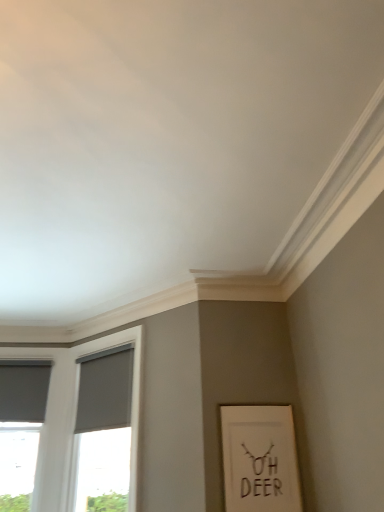
Question: Does white matte picture frame at lower right have a smaller size compared to matte gray window at left?

Choices:
 (A) yes
 (B) no

Answer: (A)

Question: Is white matte picture frame at lower right located outside matte gray window at left?

Choices:
 (A) no
 (B) yes

Answer: (B)

Question: Can you confirm if white matte picture frame at lower right is positioned to the left of matte gray window at left?

Choices:
 (A) no
 (B) yes

Answer: (A)

Question: Does white matte picture frame at lower right come behind matte gray window at left?

Choices:
 (A) no
 (B) yes

Answer: (A)

Question: Is white matte picture frame at lower right facing away from matte gray window at left?

Choices:
 (A) yes
 (B) no

Answer: (B)

Question: Is white matte picture frame at lower right surrounding matte gray window at left?

Choices:
 (A) yes
 (B) no

Answer: (B)

Question: Is matte gray window at left turned away from white matte picture frame at lower right?

Choices:
 (A) no
 (B) yes

Answer: (A)

Question: Is matte gray window at left to the left of white matte picture frame at lower right from the viewer's perspective?

Choices:
 (A) yes
 (B) no

Answer: (A)

Question: Does matte gray window at left have a smaller size compared to white matte picture frame at lower right?

Choices:
 (A) no
 (B) yes

Answer: (A)

Question: Can you confirm if matte gray window at left is taller than white matte picture frame at lower right?

Choices:
 (A) no
 (B) yes

Answer: (B)

Question: From the image's perspective, does matte gray window at left appear higher than white matte picture frame at lower right?

Choices:
 (A) no
 (B) yes

Answer: (A)

Question: From a real-world perspective, is matte gray window at left physically below white matte picture frame at lower right?

Choices:
 (A) yes
 (B) no

Answer: (B)

Question: From the image's perspective, is matte gray curtain at left, the second curtain in the right-to-left sequence, on top of white matte picture frame at lower right?

Choices:
 (A) yes
 (B) no

Answer: (A)